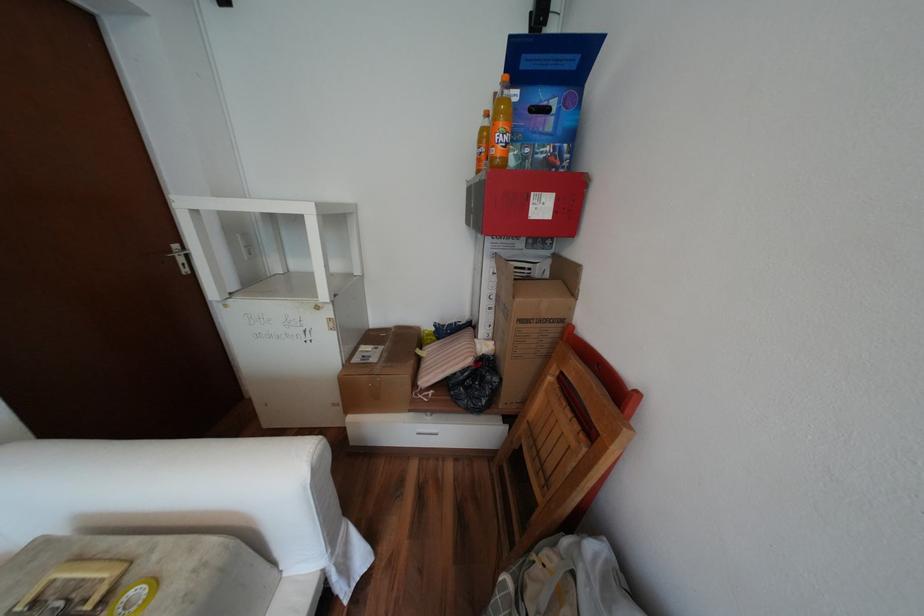
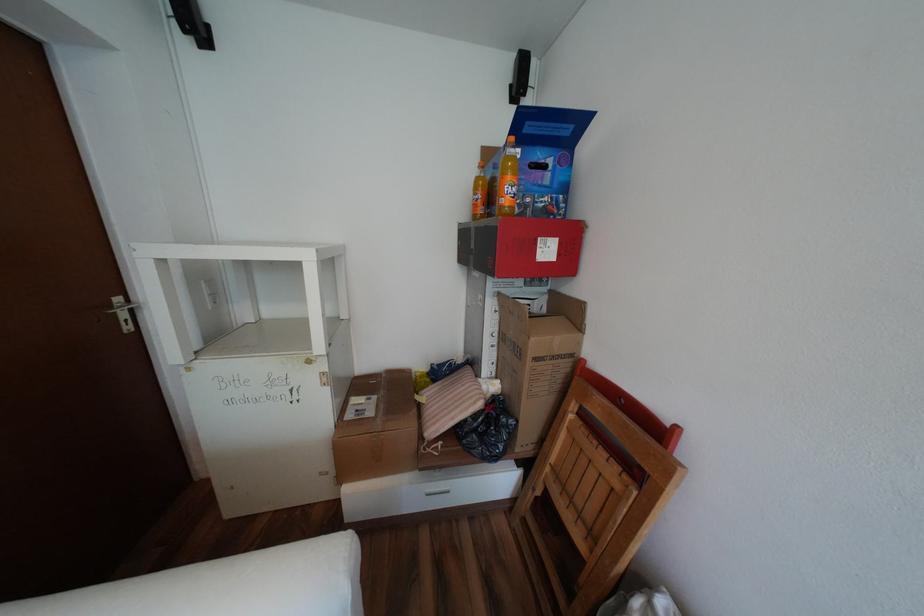
Locate, in the second image, the point that corresponds to pixel 503 147 in the first image.

(512, 197)